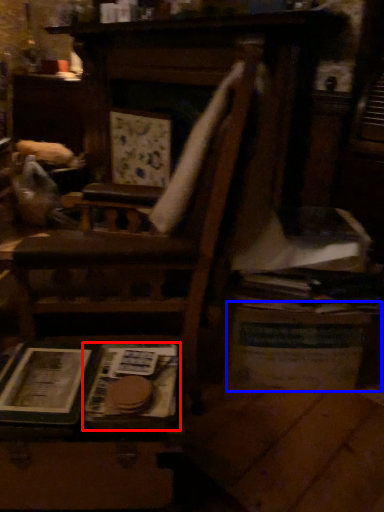
Question: Which object is further to the camera taking this photo, paperback book (highlighted by a red box) or table (highlighted by a blue box)?

Choices:
 (A) paperback book
 (B) table

Answer: (B)